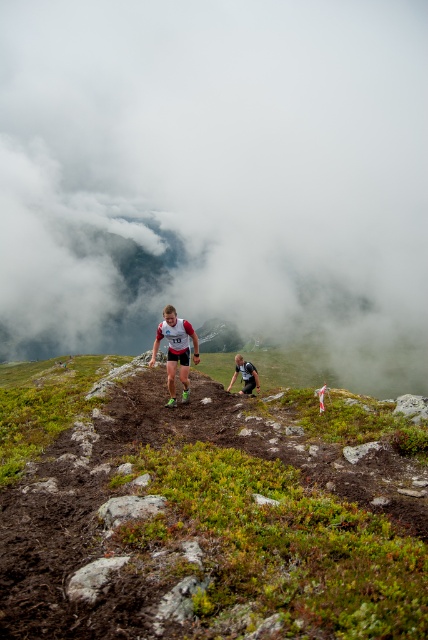
Between white fluffy cloud at upper center and black fabric running suit at center, which one appears on the right side from the viewer's perspective?

black fabric running suit at center

Image resolution: width=428 pixels, height=640 pixels. In order to click on white fluffy cloud at upper center in this screenshot , I will do click(217, 177).

Is the position of white fluffy cloud at upper center less distant than that of white mesh shirt at center?

No, it is not.

Which of these two, white fluffy cloud at upper center or white mesh shirt at center, stands shorter?

Standing shorter between the two is white mesh shirt at center.

The image size is (428, 640). Find the location of `white fluffy cloud at upper center`. white fluffy cloud at upper center is located at coordinates (217, 177).

Is white mesh shirt at center closer to camera compared to black fabric running suit at center?

Yes, white mesh shirt at center is in front of black fabric running suit at center.

Is white mesh shirt at center below black fabric running suit at center?

No, white mesh shirt at center is not below black fabric running suit at center.

Based on the photo, who is more forward, (184, 342) or (228, 385)?

Point (184, 342) is more forward.

At what (x,y) coordinates should I click in order to perform the action: click on white mesh shirt at center. Please return your answer as a coordinate pair (x, y). The width and height of the screenshot is (428, 640). Looking at the image, I should click on (175, 352).